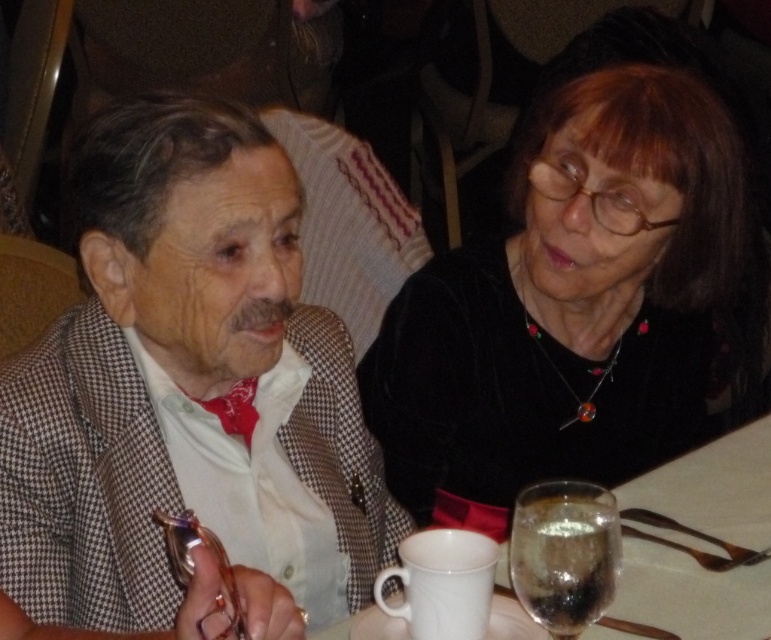
You are a server at a restaurant and need to place a 12 inch long platter between the checkered fabric suit at left and the white ceramic mug at lower center. Will there be enough space?

The distance between the checkered fabric suit at left and the white ceramic mug at lower center is 15.57 inches. Since the platter is 12 inches long, there is sufficient space to place it between them.

You are a waiter at a restaurant and need to place a dessert plate on the table. The dessert plate is too large to fit between the checkered fabric suit at left and the white ceramic mug at lower center. Which object should you avoid placing the plate near to ensure it doesn t fall off the table?

The checkered fabric suit at left is located above the white ceramic mug at lower center. To prevent the dessert plate from falling off, avoid placing it near the checkered fabric suit at left since it is higher up.